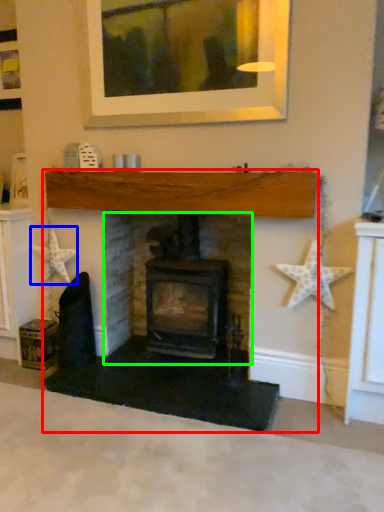
Question: Considering the real-world distances, which object is farthest from fireplace (highlighted by a red box)? starfish (highlighted by a blue box) or fireplace (highlighted by a green box)?

Choices:
 (A) starfish
 (B) fireplace

Answer: (A)